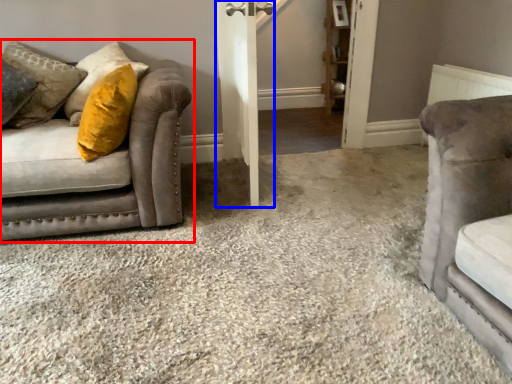
Question: Among these objects, which one is nearest to the camera, studio couch (highlighted by a red box) or barn door (highlighted by a blue box)?

Choices:
 (A) studio couch
 (B) barn door

Answer: (A)